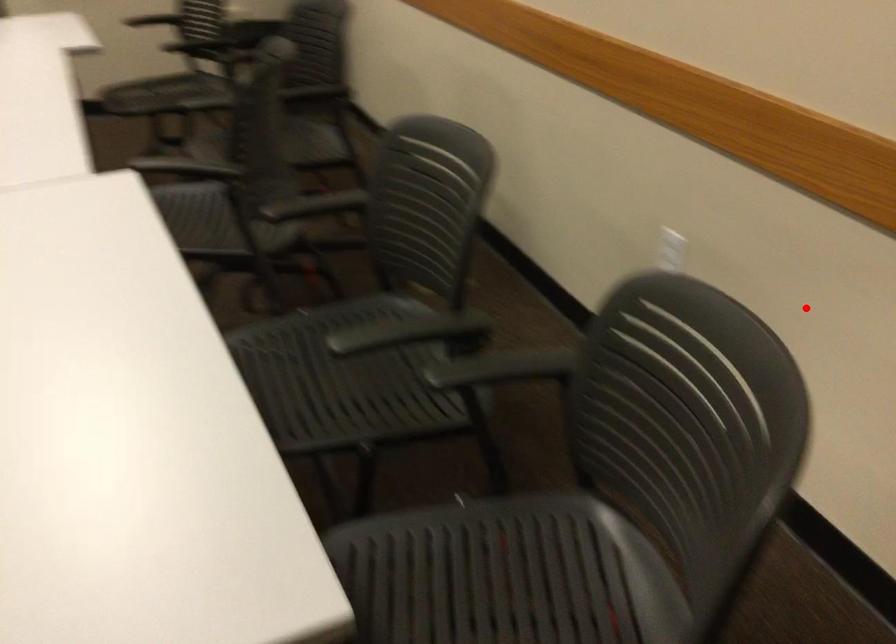
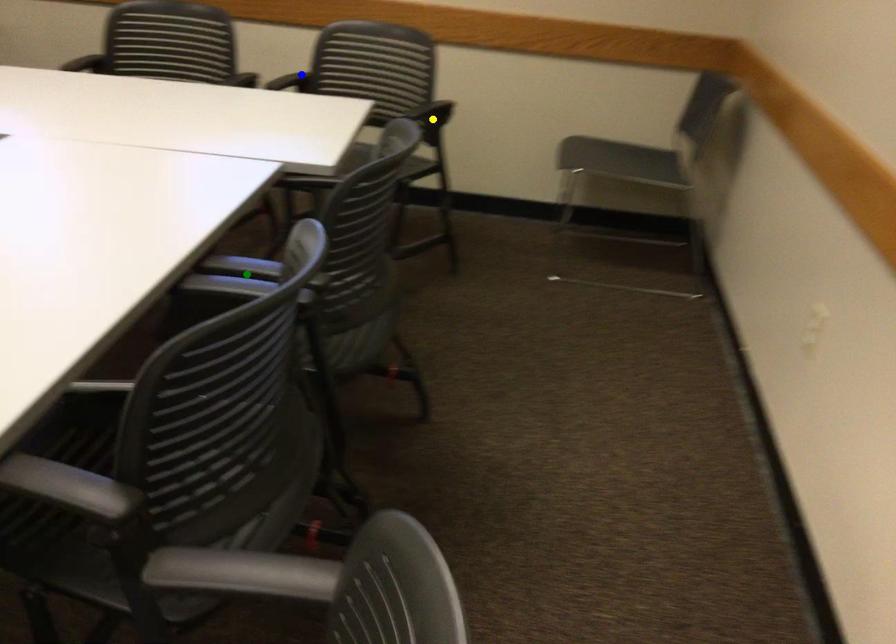
Question: I am providing you with two images of the same scene from different viewpoints. A red point is marked on the first image. You are given multiple points on the second image. Can you choose the point in image 2 that corresponds to the point in image 1?

Choices:
 (A) green point
 (B) blue point
 (C) yellow point

Answer: (B)